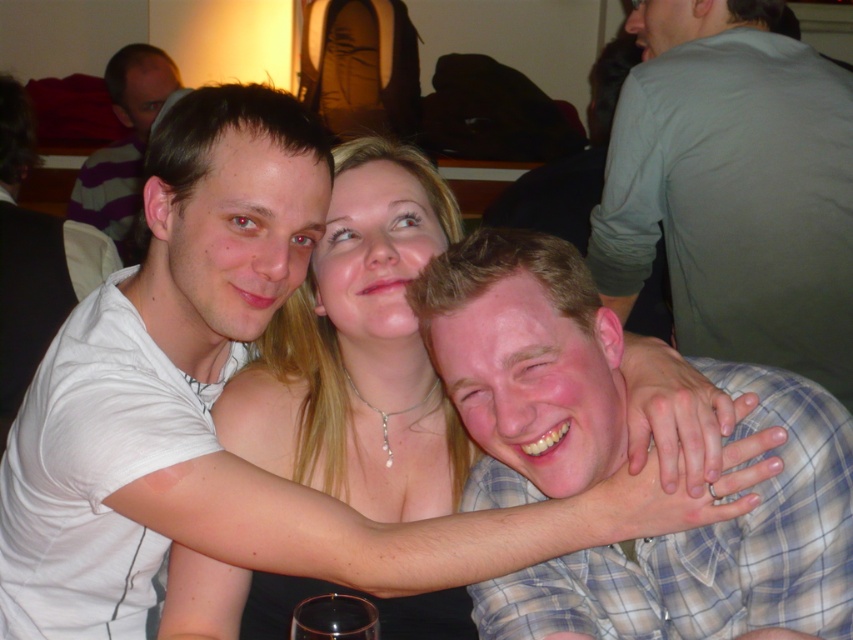
You are a photographer trying to capture the group photo of the light brown plaid shirt at center and the matte white shirt at left. Based on their positions, which one should you focus on first to ensure both are in frame?

The light brown plaid shirt at center is located below the matte white shirt at left, so you should focus on the matte white shirt at left first to ensure both are in frame.

Looking at this image, you are a photographer trying to capture a group photo of the green cotton shirt at right and the gray fabric shirt at upper right. Which shirt should you focus on first if you want to ensure both are in focus, considering their heights?

The green cotton shirt at right has a lesser height compared to gray fabric shirt at upper right, so you should focus on the gray fabric shirt at upper right first to ensure both are in focus.

You are standing at the entrance of the room and want to take a photo of the light brown plaid shirt at center. According to the coordinates provided, where should you aim your camera to capture it?

The light brown plaid shirt at center is located at coordinates point (714, 547), so aim your camera towards that point to capture it.